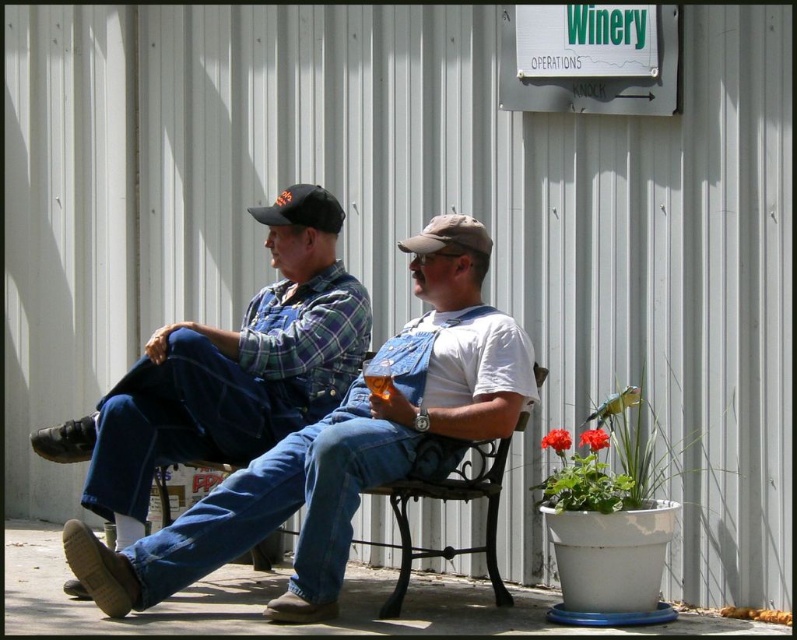
Question: Which point is farther to the camera?

Choices:
 (A) tan fabric baseball cap at center
 (B) metallic brown bench at center

Answer: (A)

Question: Can you confirm if black fabric baseball cap at upper center is positioned above tan fabric baseball cap at center?

Choices:
 (A) no
 (B) yes

Answer: (B)

Question: Which point is farther from the camera taking this photo?

Choices:
 (A) (328, 364)
 (B) (336, 212)

Answer: (B)

Question: Does denim overalls at center have a lesser width compared to tan fabric baseball cap at center?

Choices:
 (A) no
 (B) yes

Answer: (A)

Question: Among these points, which one is nearest to the camera?

Choices:
 (A) (461, 236)
 (B) (351, 323)

Answer: (A)

Question: Can you confirm if denim overalls at center is positioned above metallic brown bench at center?

Choices:
 (A) no
 (B) yes

Answer: (B)